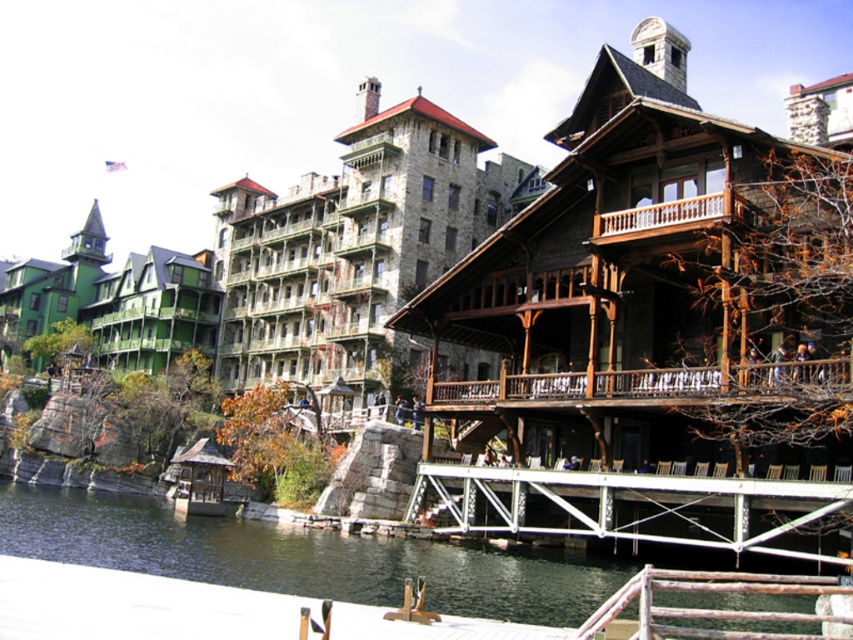
You are a tourist standing on the white metal dock at lower center and want to take a photo of the brown wooden railing at center. Since the dock is elevated, will you need to look up or down to frame the railing in your camera?

The white metal dock at lower center is much taller than the brown wooden railing at center, so you will need to look down to frame the railing in your camera.

You are standing at the riverside and want to cross to the wooden structure on the right. You see the dark green water at lower left and the white metal dock at lower center. Which object is closer to you, and would stepping onto the dock keep you above the water?

The dark green water at lower left is closer to the viewer than the white metal dock at lower center. Since the dock is farther away, stepping onto it would place you above the water.

You are standing on the riverside path and want to take a photo of the dark green water at lower left without the brown wooden railing at center blocking the view. Is it possible to position yourself in a way that the railing is not visible in the photo?

Yes, since the dark green water at lower left is in front of the brown wooden railing at center, positioning yourself behind the water area would allow you to capture the water without the railing obstructing the view.